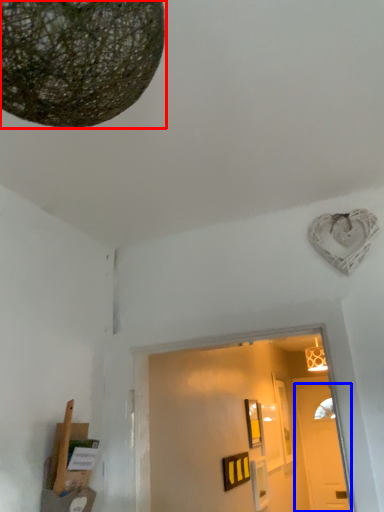
Question: Which object is closer to the camera taking this photo, lamp (highlighted by a red box) or door (highlighted by a blue box)?

Choices:
 (A) lamp
 (B) door

Answer: (A)